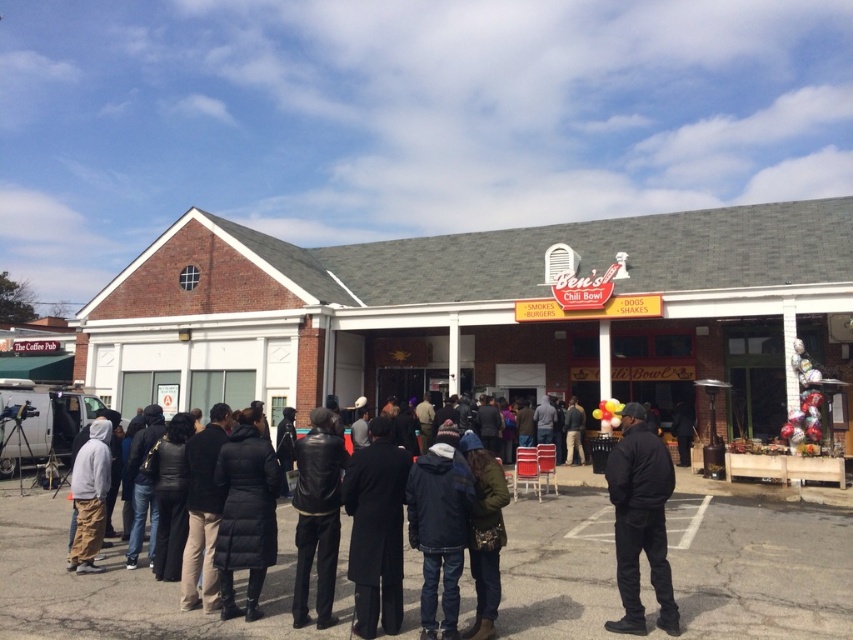
You are a pedestrian standing at the edge of the sidewalk near the white brick building at center and the white painted parking line at lower center. Which object is closer to your left side?

The white brick building at center is positioned on the left side of the white painted parking line at lower center, so it is closer to your left side.